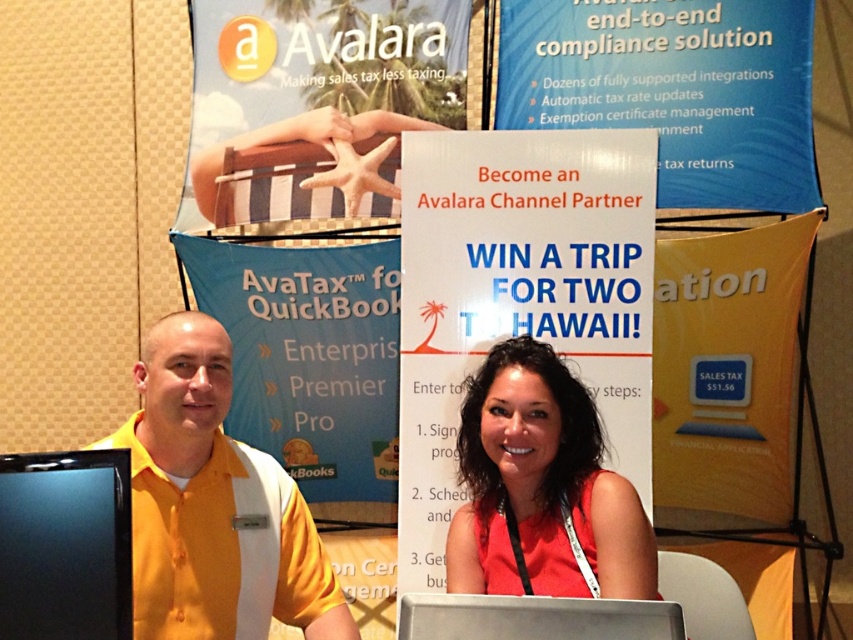
Question: Among these points, which one is nearest to the camera?

Choices:
 (A) [508, 499]
 (B) [653, 630]

Answer: (B)

Question: Is yellow shirt at center above red satin dress at center?

Choices:
 (A) yes
 (B) no

Answer: (A)

Question: Is the position of yellow shirt at center more distant than that of silver metallic laptop at center?

Choices:
 (A) no
 (B) yes

Answer: (B)

Question: Which object is closer to the camera taking this photo?

Choices:
 (A) silver metallic laptop at center
 (B) yellow shirt at center
 (C) red satin dress at center

Answer: (A)

Question: Which of these objects is positioned farthest from the yellow shirt at center?

Choices:
 (A) red satin dress at center
 (B) silver metallic laptop at center

Answer: (B)

Question: From the image, what is the correct spatial relationship of red satin dress at center in relation to silver metallic laptop at center?

Choices:
 (A) right
 (B) left

Answer: (A)